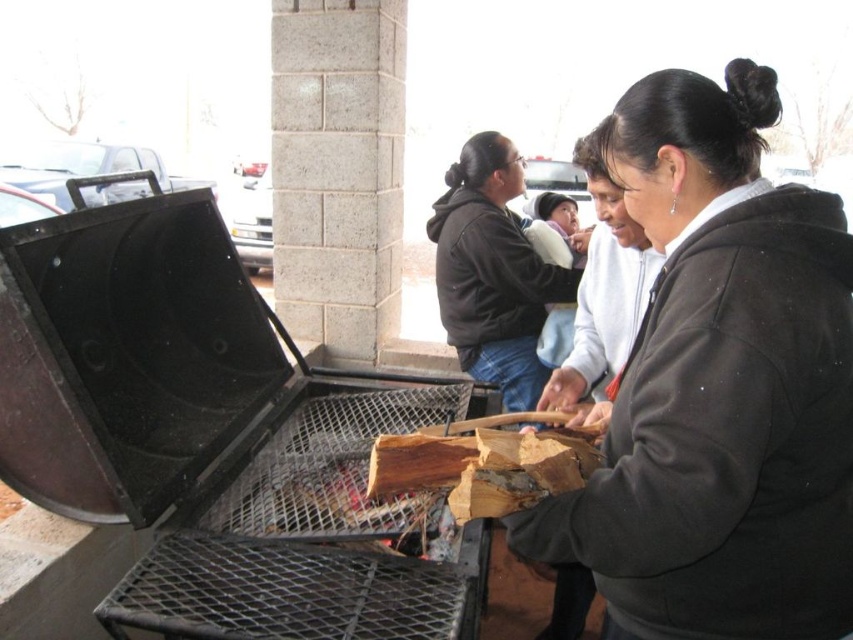
From the picture: You are standing in the outdoor barbecue area described. If you face the black matte grill at left, which direction would the vehicles in the background be located relative to your position?

The vehicles in the background are located behind you since the black matte grill at left is positioned in the foreground, and the vehicles are part of the background setting.

You are standing in the parking lot and see the dark gray fleece jacket at center and the dark brown hoodie at center. Which clothing item is closer to the ground?

The dark gray fleece jacket at center is positioned under the dark brown hoodie at center, so it is closer to the ground.